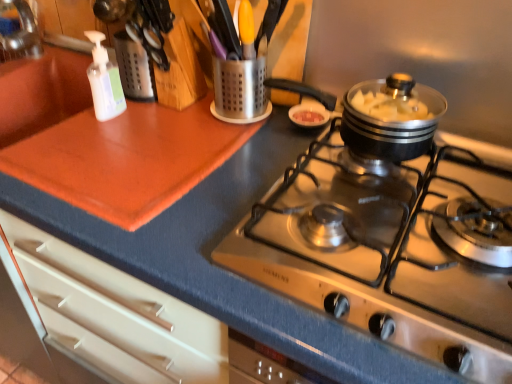
The width and height of the screenshot is (512, 384). Identify the location of free spot to the left of metallic utensil holder at upper center. (169, 126).